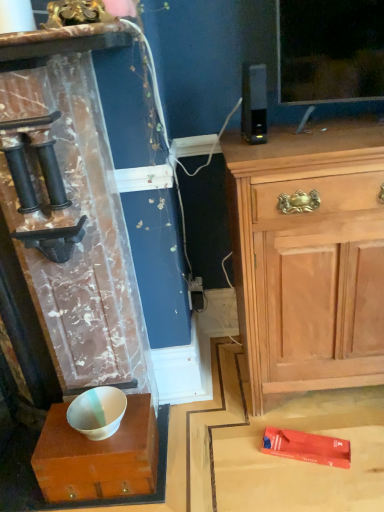
Find the location of a particular element. The width and height of the screenshot is (384, 512). free point above white glossy bowl at center (from a real-world perspective) is located at coordinates (97, 428).